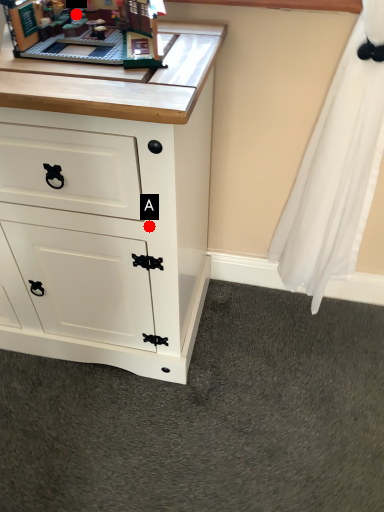
Question: Two points are circled on the image, labeled by A and B beside each circle. Which point is farther from the camera taking this photo?

Choices:
 (A) A is further
 (B) B is further

Answer: (B)